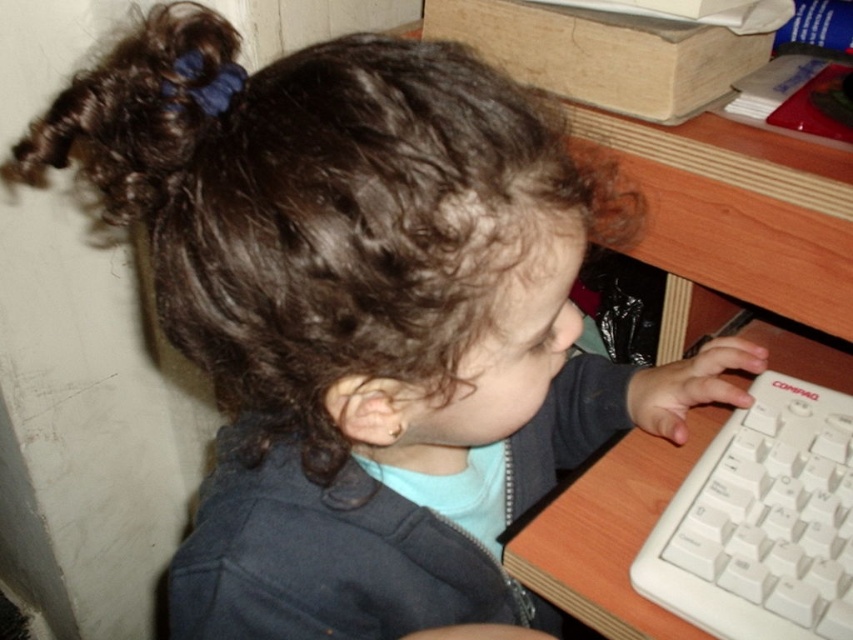
Is white plastic keyboard at right closer to the viewer compared to dark curly hair at upper left?

No, it is not.

The image size is (853, 640). What do you see at coordinates (762, 522) in the screenshot?
I see `white plastic keyboard at right` at bounding box center [762, 522].

This screenshot has width=853, height=640. I want to click on white plastic keyboard at right, so click(762, 522).